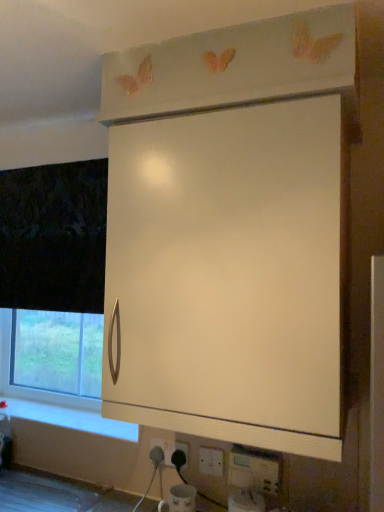
Question: Can you confirm if white plastic electric outlet at lower center, which is the third electric outlet in front-to-back order, is smaller than white matte cabinet at upper center?

Choices:
 (A) no
 (B) yes

Answer: (B)

Question: From a real-world perspective, is white plastic electric outlet at lower center, the 1th electric outlet from the left, beneath white matte cabinet at upper center?

Choices:
 (A) no
 (B) yes

Answer: (B)

Question: Is white plastic electric outlet at lower center, marked as the third electric outlet in a right-to-left arrangement, behind white matte cabinet at upper center?

Choices:
 (A) yes
 (B) no

Answer: (A)

Question: Does white plastic electric outlet at lower center, marked as the third electric outlet in a right-to-left arrangement, have a lesser height compared to white matte cabinet at upper center?

Choices:
 (A) yes
 (B) no

Answer: (A)

Question: Could white matte cabinet at upper center be considered to be inside white plastic electric outlet at lower center, which is the third electric outlet in front-to-back order?

Choices:
 (A) yes
 (B) no

Answer: (B)

Question: Is point (235, 449) closer or farther from the camera than point (329, 440)?

Choices:
 (A) farther
 (B) closer

Answer: (A)

Question: From the image's perspective, is white plastic electric outlet at lower center, marked as the 1th electric outlet in a front-to-back arrangement, above or below white matte cabinet at upper center?

Choices:
 (A) below
 (B) above

Answer: (A)

Question: From a real-world perspective, relative to white matte cabinet at upper center, is white plastic electric outlet at lower center, marked as the 1th electric outlet in a front-to-back arrangement, vertically above or below?

Choices:
 (A) above
 (B) below

Answer: (B)

Question: Looking at their shapes, would you say white plastic electric outlet at lower center, placed as the third electric outlet when sorted from back to front, is wider or thinner than white matte cabinet at upper center?

Choices:
 (A) wide
 (B) thin

Answer: (B)

Question: From a real-world perspective, is white matte cabinet at upper center above or below white plastic electric outlet at lower center, placed as the third electric outlet when sorted from back to front?

Choices:
 (A) below
 (B) above

Answer: (B)

Question: Looking at the image, does white matte cabinet at upper center seem bigger or smaller compared to white plastic electric outlet at lower center, which is counted as the third electric outlet, starting from the left?

Choices:
 (A) big
 (B) small

Answer: (A)

Question: Considering the positions of white matte cabinet at upper center and white plastic electric outlet at lower center, placed as the first electric outlet when sorted from right to left, in the image, is white matte cabinet at upper center wider or thinner than white plastic electric outlet at lower center, placed as the first electric outlet when sorted from right to left,?

Choices:
 (A) thin
 (B) wide

Answer: (B)

Question: Is point (264, 261) closer or farther from the camera than point (244, 475)?

Choices:
 (A) farther
 (B) closer

Answer: (B)

Question: Is point (168, 441) closer or farther from the camera than point (244, 370)?

Choices:
 (A) farther
 (B) closer

Answer: (A)

Question: Relative to white matte cabinet at upper center, is white plastic electric outlet at lower center, arranged as the first electric outlet when viewed from the back, in front or behind?

Choices:
 (A) behind
 (B) front

Answer: (A)